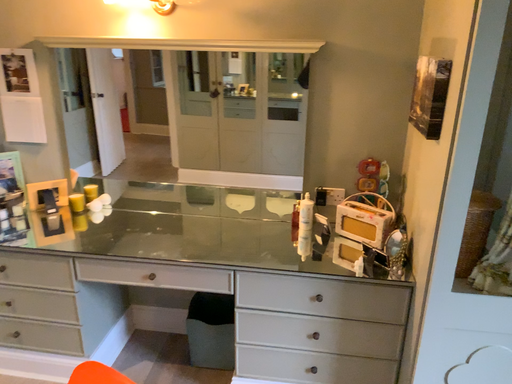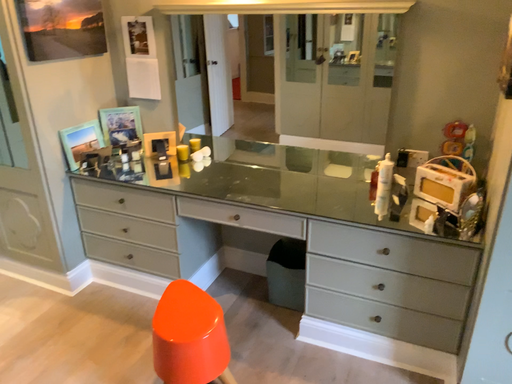
Question: Which way did the camera rotate in the video?

Choices:
 (A) rotated left
 (B) rotated right

Answer: (A)